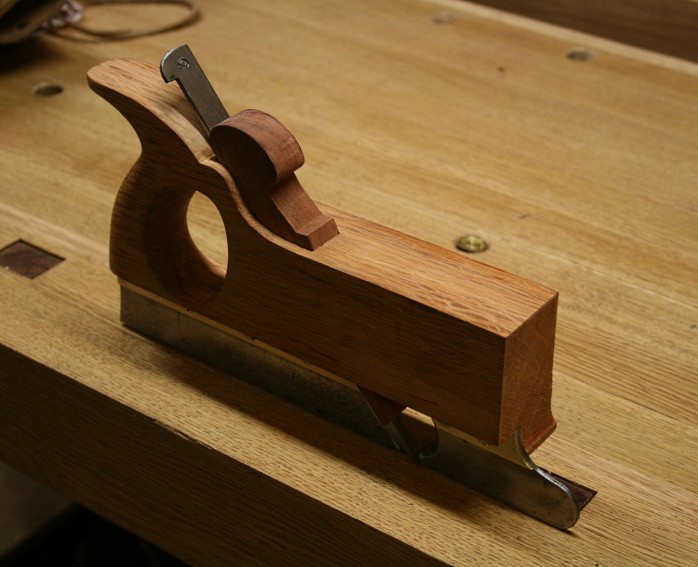
Locate an element on the screen. wood table side is located at coordinates (98, 462).